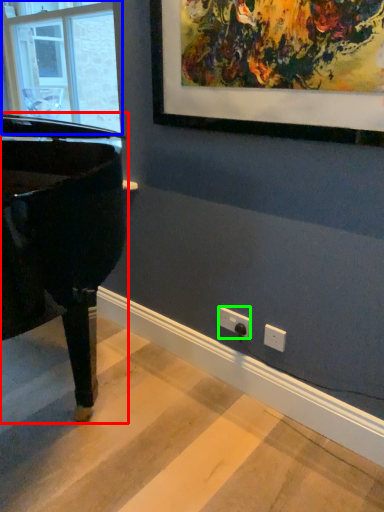
Question: Which object is positioned farthest from piano (highlighted by a red box)? Select from window (highlighted by a blue box) and electric outlet (highlighted by a green box).

Choices:
 (A) window
 (B) electric outlet

Answer: (A)